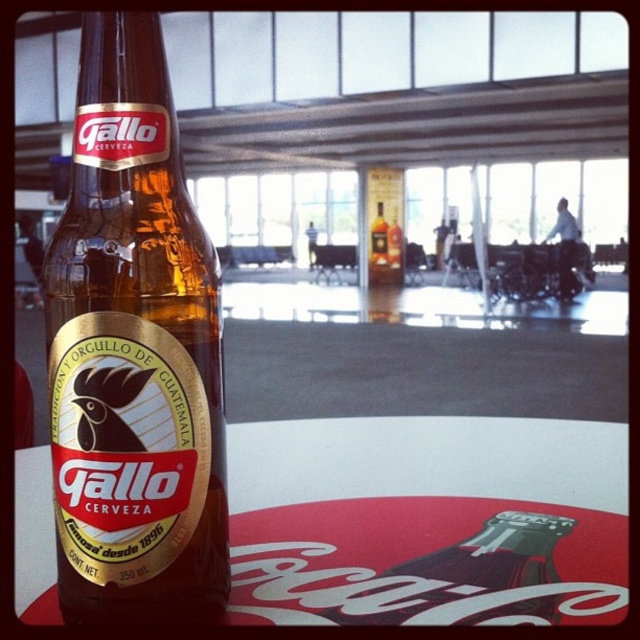
You are a bartender preparing to stock a shelf that can only accommodate bottles narrower than 10 cm. You have two bottles in front of you, the brown glass bottle at center and the matte glass bottle at center. Based on their widths, which one can fit on the shelf?

The matte glass bottle at center can fit on the shelf because its width is smaller than the brown glass bottle at center and narrower than 10 cm.

You are a bartender preparing to place a drink on the white glossy table at center. There is a brown glass bottle at center currently on the table. Can you place a small coaster underneath the bottle without moving it?

The brown glass bottle at center is above white glossy table at center, so you can place a small coaster underneath the bottle without moving it as there is space between the bottle and the table.

You are a delivery person who needs to place two bottles in a box that can only hold items within 1.5 meters of each other. The bottles are the brown glass bottle at center and the matte glass bottle at center. Will they fit in the box?

The distance between the brown glass bottle at center and the matte glass bottle at center is 1.68 meters, which exceeds the box capacity of 1.5 meters. They will not fit together in the box.